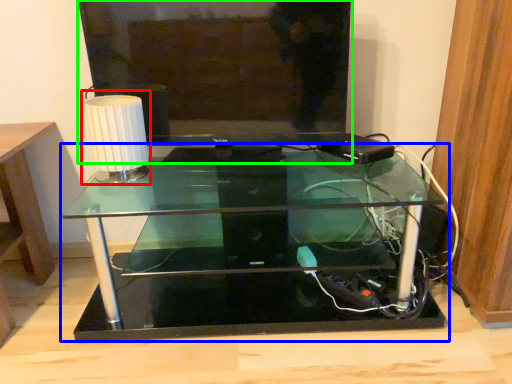
Question: Considering the real-world distances, which object is closest to table lamp (highlighted by a red box)? table (highlighted by a blue box) or television (highlighted by a green box).

Choices:
 (A) table
 (B) television

Answer: (B)